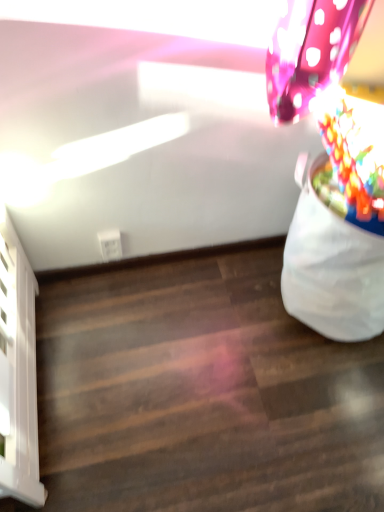
Question: Should I look upward or downward to see wooden floor at lower right?

Choices:
 (A) up
 (B) down

Answer: (B)

Question: Does wooden floor at lower right have a lesser height compared to multicolored plastic flower at upper right?

Choices:
 (A) yes
 (B) no

Answer: (A)

Question: Can you confirm if wooden floor at lower right is taller than multicolored plastic flower at upper right?

Choices:
 (A) no
 (B) yes

Answer: (A)

Question: From a real-world perspective, does wooden floor at lower right sit lower than multicolored plastic flower at upper right?

Choices:
 (A) yes
 (B) no

Answer: (A)

Question: Is wooden floor at lower right next to multicolored plastic flower at upper right?

Choices:
 (A) yes
 (B) no

Answer: (B)

Question: Is wooden floor at lower right surrounding multicolored plastic flower at upper right?

Choices:
 (A) yes
 (B) no

Answer: (B)

Question: Considering the relative sizes of wooden floor at lower right and multicolored plastic flower at upper right in the image provided, is wooden floor at lower right thinner than multicolored plastic flower at upper right?

Choices:
 (A) yes
 (B) no

Answer: (B)

Question: Is multicolored plastic flower at upper right wider than wooden floor at lower right?

Choices:
 (A) no
 (B) yes

Answer: (A)

Question: Considering the relative sizes of multicolored plastic flower at upper right and wooden floor at lower right in the image provided, is multicolored plastic flower at upper right thinner than wooden floor at lower right?

Choices:
 (A) no
 (B) yes

Answer: (B)

Question: Considering the relative sizes of multicolored plastic flower at upper right and wooden floor at lower right in the image provided, is multicolored plastic flower at upper right shorter than wooden floor at lower right?

Choices:
 (A) yes
 (B) no

Answer: (B)

Question: Can we say multicolored plastic flower at upper right lies outside wooden floor at lower right?

Choices:
 (A) no
 (B) yes

Answer: (B)

Question: Would you say multicolored plastic flower at upper right contains wooden floor at lower right?

Choices:
 (A) yes
 (B) no

Answer: (B)

Question: Does multicolored plastic flower at upper right come in front of wooden floor at lower right?

Choices:
 (A) yes
 (B) no

Answer: (A)

Question: From a real-world perspective, does wooden floor at lower right sit lower than white fabric bean bag at right?

Choices:
 (A) no
 (B) yes

Answer: (B)